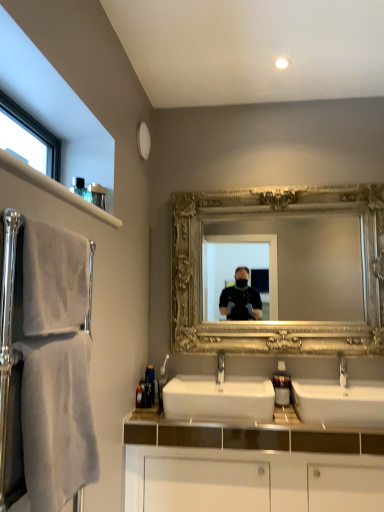
I want to click on free space in front of silver metallic faucet at center, so click(347, 397).